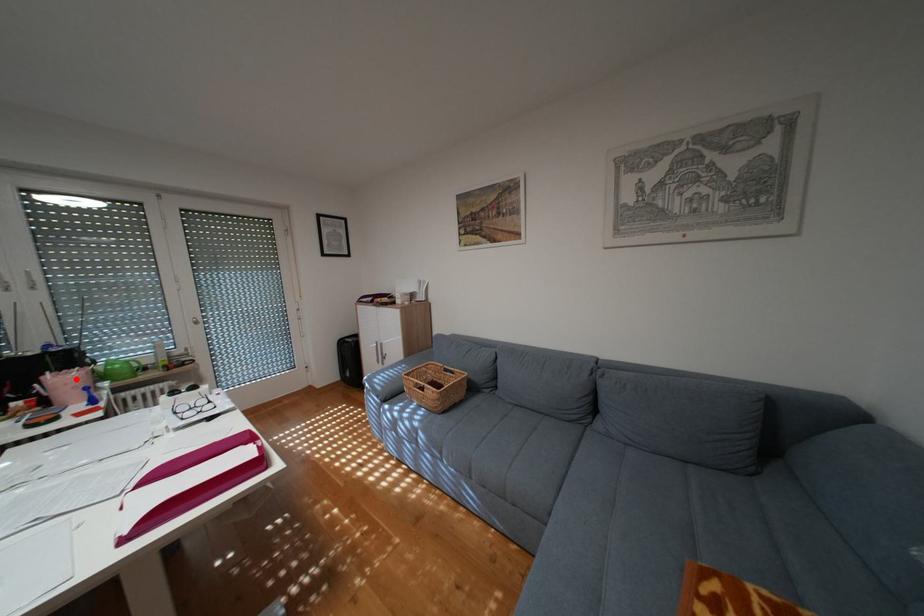
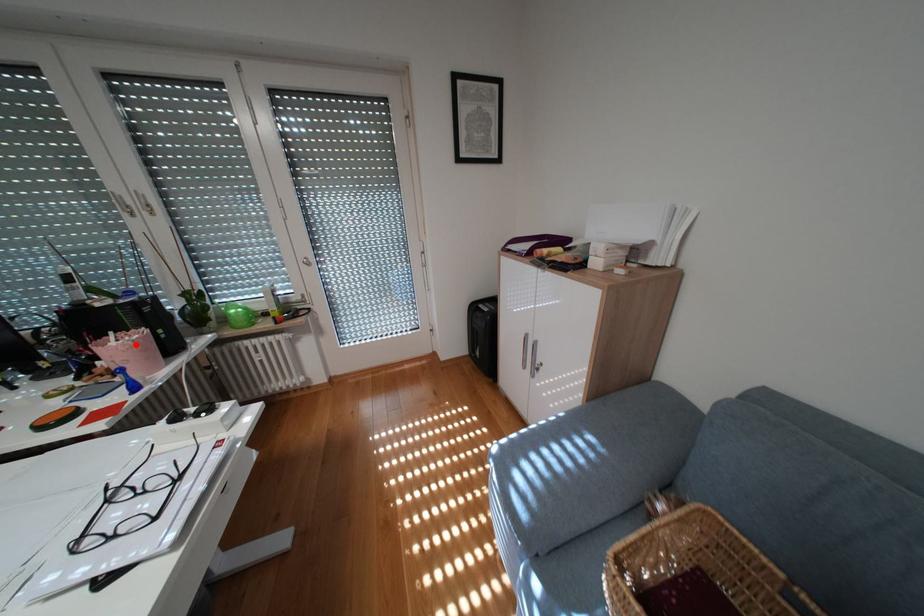
I am providing you with two images of the same scene from different viewpoints. A red point is marked on the first image and another point is marked on the second image. Is the red point in image1 aligned with the point shown in image2?

Yes